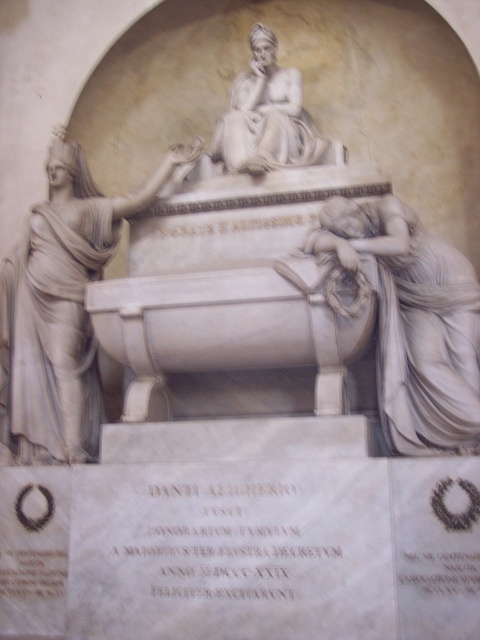
You are an art student analyzing the monument. You notice two statues, the white marble statue at left and the white marble statue at lower right. Which one has a larger size?

The white marble statue at left is bigger than the white marble statue at lower right.

You are an archaeologist examining the monument. You need to determine which object is bigger between the white marble sarcophagus at center and the white marble statue at left. Based on the scene description, which one is larger?

The white marble sarcophagus at center is larger in size than the white marble statue at left according to the description.